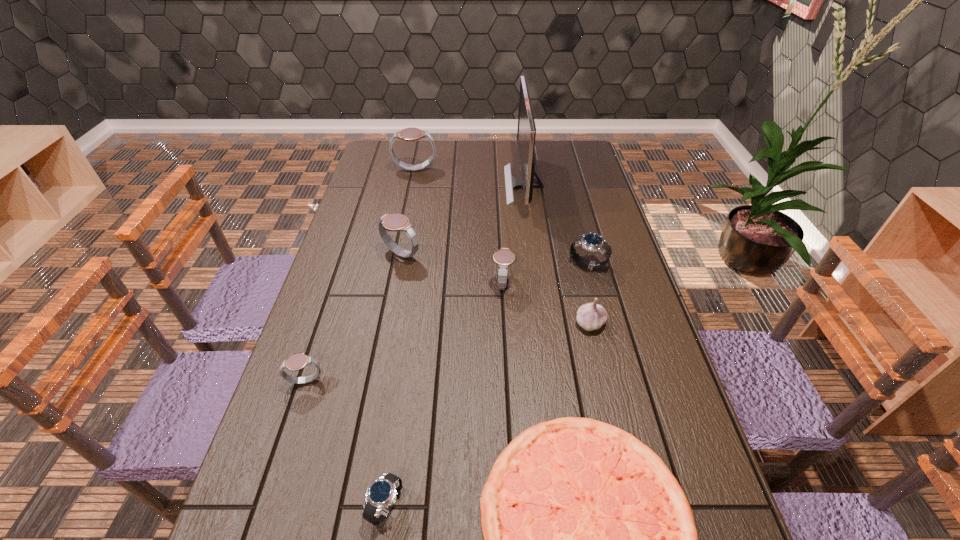
Locate an element on the screen. vacant area situated on the right of the second nearest gray watch is located at coordinates (607, 284).

This screenshot has height=540, width=960. I want to click on free spot located 0.280m on the back of the bigger silver watch, so click(x=572, y=204).

The image size is (960, 540). I want to click on free space located 0.050m on the left of the garlic, so click(x=556, y=323).

Locate an element on the screen. free space located on the back of the leftmost watch is located at coordinates (344, 266).

Where is `vacant position located 0.110m on the back of the smaller silver watch`? The height and width of the screenshot is (540, 960). vacant position located 0.110m on the back of the smaller silver watch is located at coordinates (397, 431).

Where is `monitor positioned at the far edge`? This screenshot has height=540, width=960. monitor positioned at the far edge is located at coordinates (526, 131).

This screenshot has width=960, height=540. I want to click on watch that is at the far edge, so click(408, 134).

This screenshot has height=540, width=960. Find the location of `watch that is at the right edge`. watch that is at the right edge is located at coordinates (594, 242).

This screenshot has height=540, width=960. What are the coordinates of `garlic that is at the right edge` in the screenshot? It's located at (591, 316).

Locate an element on the screen. The width and height of the screenshot is (960, 540). object located at the far left corner is located at coordinates (408, 134).